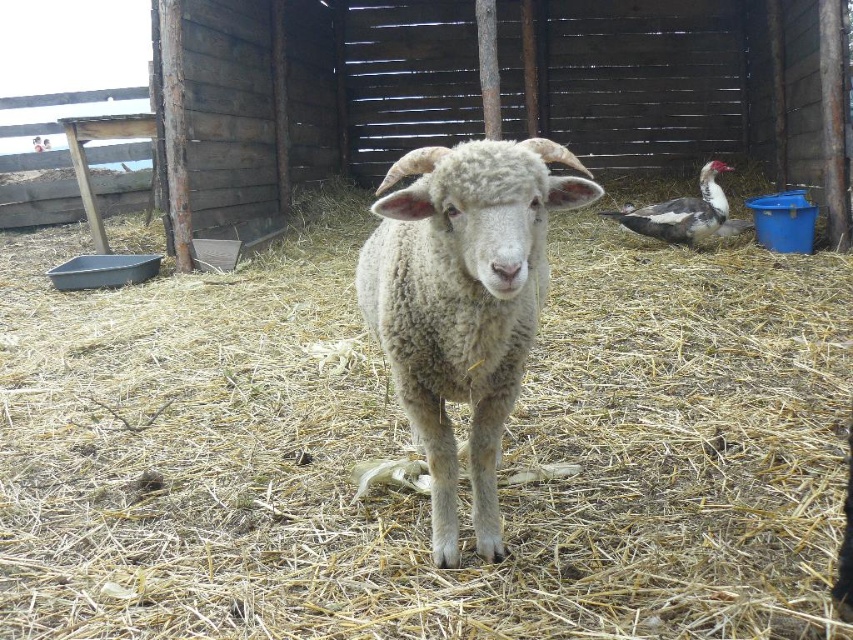
Between point (167, 289) and point (410, 298), which one is positioned in front?

Point (410, 298) is in front.

Can you confirm if fibrous straw at center is thinner than white woolly lamb at center?

Incorrect, fibrous straw at center's width is not less than white woolly lamb at center's.

Between point (0, 520) and point (480, 376), which one is positioned behind?

The point (0, 520) is behind.

In order to click on fibrous straw at center in this screenshot , I will do `click(408, 451)`.